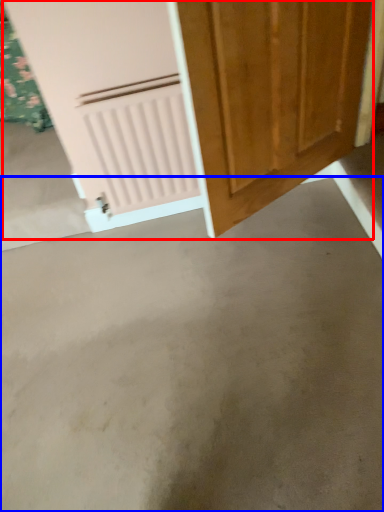
Question: Which of the following is the farthest to the observer, door (highlighted by a red box) or concrete (highlighted by a blue box)?

Choices:
 (A) door
 (B) concrete

Answer: (B)